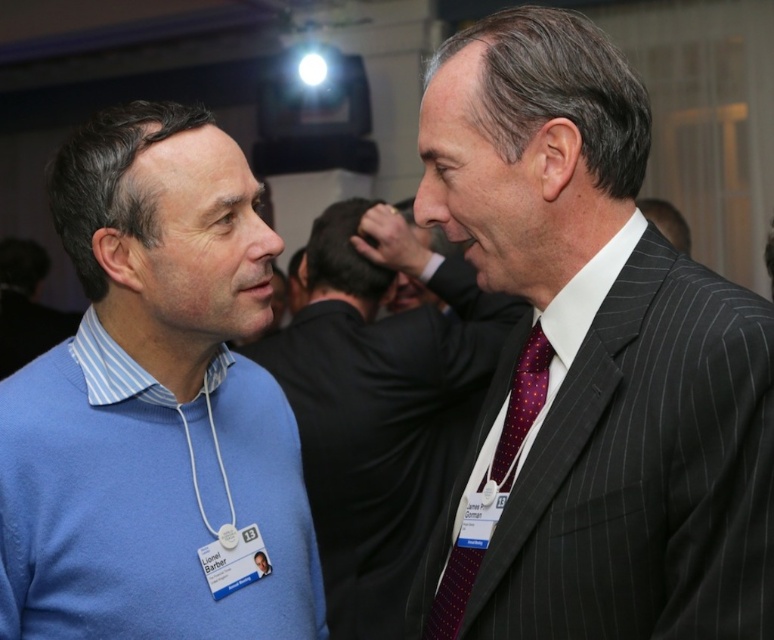
Can you confirm if dark gray pinstripe suit at center is positioned above purple dotted silk tie at center?

Yes, dark gray pinstripe suit at center is above purple dotted silk tie at center.

Does dark gray pinstripe suit at center appear on the right side of purple dotted silk tie at center?

Yes, dark gray pinstripe suit at center is to the right of purple dotted silk tie at center.

Is point (507, 410) positioned before point (529, 424)?

No, (507, 410) is behind (529, 424).

Where is `dark gray pinstripe suit at center`? The image size is (774, 640). dark gray pinstripe suit at center is located at coordinates (591, 362).

Is point (553, 541) behind point (228, 586)?

No, (553, 541) is closer to viewer.

Which is below, dark gray pinstripe suit at center or blue sweater at center?

blue sweater at center is lower down.

You are a GUI agent. You are given a task and a screenshot of the screen. Output one action in this format:
    pyautogui.click(x=<x>, y=<y>)
    Task: Click on the dark gray pinstripe suit at center
    The width and height of the screenshot is (774, 640).
    Given the screenshot: What is the action you would take?
    pyautogui.click(x=591, y=362)

Does point (409, 506) come behind point (457, 586)?

Yes, point (409, 506) is farther from viewer.

Does matte black suit at center appear over purple dotted silk tie at center?

Indeed, matte black suit at center is positioned over purple dotted silk tie at center.

Which is in front, point (334, 579) or point (502, 444)?

Positioned in front is point (502, 444).

This screenshot has width=774, height=640. What are the coordinates of `matte black suit at center` in the screenshot? It's located at (379, 412).